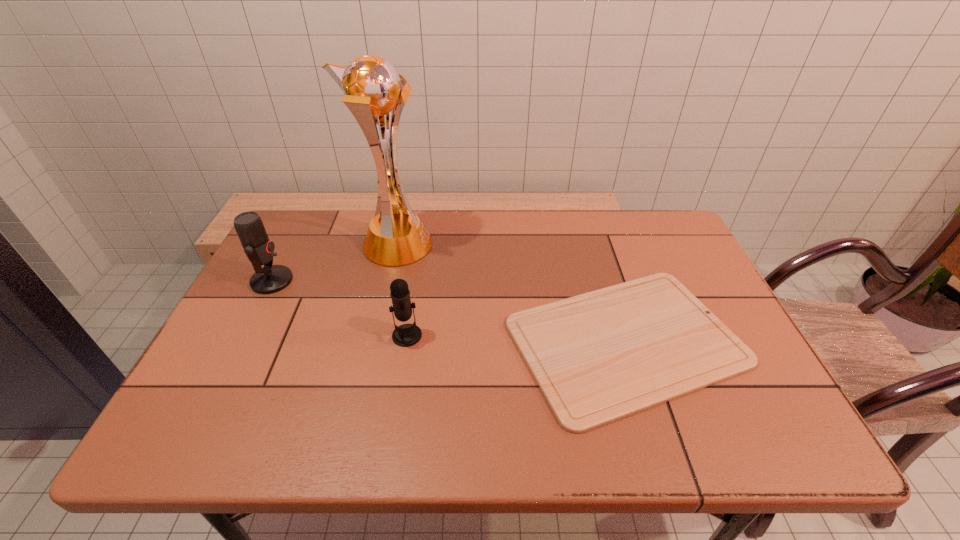
Identify the location of vacant space at the far right corner of the desktop. Image resolution: width=960 pixels, height=540 pixels. (639, 220).

Identify the location of free space at the near right corner of the desktop. The height and width of the screenshot is (540, 960). 785,451.

At what (x,y) coordinates should I click in order to perform the action: click on free space between the chopping board and the trophy. Please return your answer as a coordinate pair (x, y). Looking at the image, I should click on (511, 293).

The width and height of the screenshot is (960, 540). Identify the location of empty space that is in between the leftmost object and the tallest object. (334, 263).

Find the location of a particular element. This screenshot has width=960, height=540. free area in between the rightmost object and the taller microphone is located at coordinates (449, 311).

Where is `free space between the shortest object and the farther microphone`? This screenshot has width=960, height=540. free space between the shortest object and the farther microphone is located at coordinates (449, 311).

Identify the location of unoccupied position between the second tallest object and the trophy. (334, 263).

You are a GUI agent. You are given a task and a screenshot of the screen. Output one action in this format:
    pyautogui.click(x=<x>, y=<y>)
    Task: Click on the empty location between the left microphone and the tallest object
    The width and height of the screenshot is (960, 540).
    Given the screenshot: What is the action you would take?
    pyautogui.click(x=334, y=263)

Find the location of a particular element. This screenshot has width=960, height=540. free space between the tallest object and the third shortest object is located at coordinates (334, 263).

Locate an element on the screen. Image resolution: width=960 pixels, height=540 pixels. vacant point located between the second tallest object and the nearer microphone is located at coordinates (340, 308).